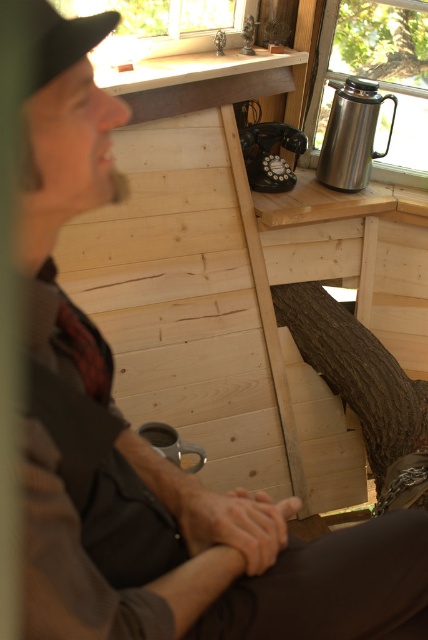
Question: Can you confirm if dark brown wood tree trunk at center is positioned above brown rough bark tree at upper right?

Choices:
 (A) no
 (B) yes

Answer: (A)

Question: Which point is farther to the camera?

Choices:
 (A) (395, 387)
 (B) (383, 13)

Answer: (B)

Question: From the image, what is the correct spatial relationship of dark brown wood tree trunk at center in relation to brown rough bark tree at upper right?

Choices:
 (A) below
 (B) above

Answer: (A)

Question: Which point is closer to the camera taking this photo?

Choices:
 (A) (336, 326)
 (B) (389, 26)

Answer: (A)

Question: Which point appears farthest from the camera in this image?

Choices:
 (A) (353, 6)
 (B) (407, 388)

Answer: (A)

Question: Is dark brown wood tree trunk at center smaller than brown rough bark tree at upper right?

Choices:
 (A) no
 (B) yes

Answer: (A)